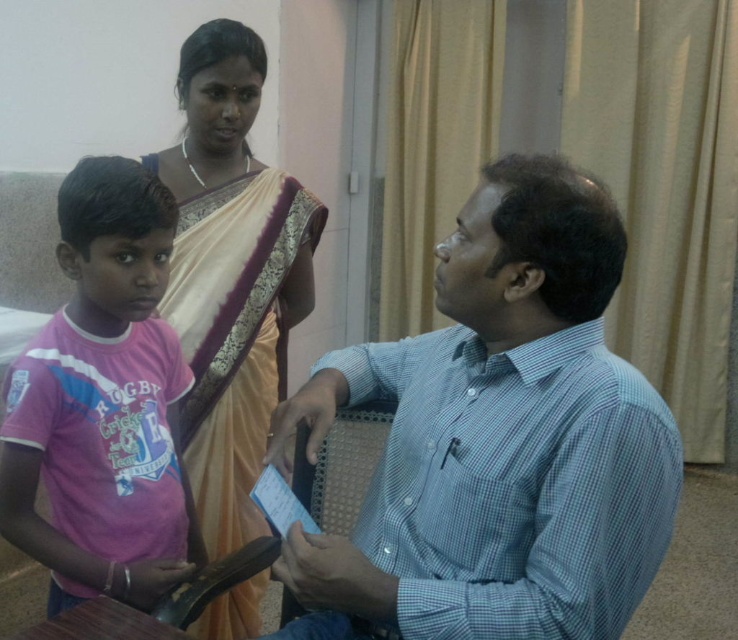
In the scene shown: You are a delivery person who needs to place a small package between the blue checkered shirt at right and the pink jersey at left. Can you fit the package in the space between them if the package is 16 inches long?

The blue checkered shirt at right is 15.89 inches away from the pink jersey at left. Since the package is 16 inches long, it is slightly longer than the available space. Therefore, the package cannot fit between them.

You are a fashion designer observing the scene. You need to determine which item has a greater width between the pink jersey at left and the beige silk saree at upper center. Which one is wider?

The beige silk saree at upper center is wider than the pink jersey at left.

In the scene described, there is a pink jersey at left and a beige silk saree at upper center. Which object is positioned more to the left?

The pink jersey at left is positioned more to the left than the beige silk saree at upper center.